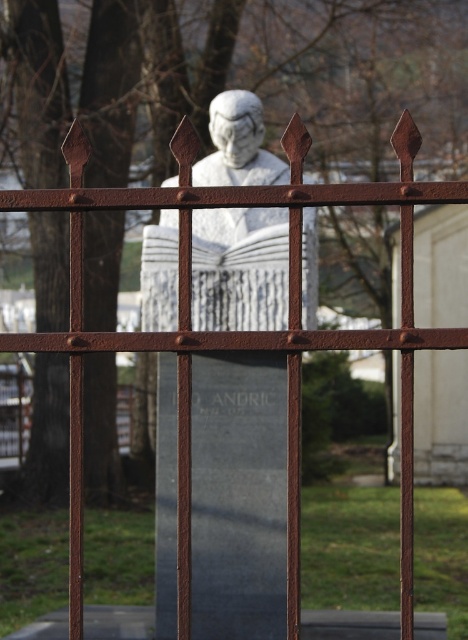
You are an art conservator assessing the stone sculptures in the garden. You notice the white marble bust at center and the white marble statue at center. Which one is taller?

The white marble bust at center is taller than the white marble statue at center.

You are a painter standing 10 feet away from the white marble bust at center. You want to paint the fence behind it but need to be at least 50 feet away to get the entire scene in your view. Can you move back enough to do this without going beyond the property line that is 70 feet from the bust?

The distance between you and the white marble bust at center is currently 10 feet. To capture the entire scene, you need to be at least 50 feet away. Since the property line is 70 feet from the bust, moving back to 50 feet is within the allowed distance. Therefore, you can move back 40 feet from your current position to be 50 feet away from the bust and paint the fence behind it while staying within the property boundaries.

You are an art student visiting a historical site. You see the white marble bust at center and the white marble statue at center. Which one is located to the left?

The white marble bust at center is positioned on the left side of the white marble statue at center.